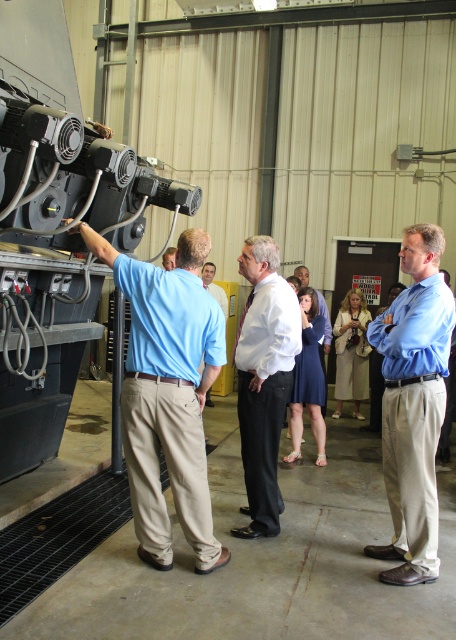
Question: Among these points, which one is nearest to the camera?

Choices:
 (A) (366, 547)
 (B) (172, 284)

Answer: (B)

Question: Which of the following is the closest to the observer?

Choices:
 (A) blue cotton shirt at left
 (B) blue shirt at center
 (C) blue dress at center

Answer: (A)

Question: Is matte blue shirt at left further to the viewer compared to blue dress at center?

Choices:
 (A) yes
 (B) no

Answer: (B)

Question: Which point is farther to the camera?

Choices:
 (A) light blue shirt at center
 (B) white dress shirt at center
 (C) blue dress at center
 (D) blue shirt at center

Answer: (D)

Question: Can you confirm if light blue shirt at center is bigger than blue dress at center?

Choices:
 (A) no
 (B) yes

Answer: (A)

Question: From the image, what is the correct spatial relationship of light blue shirt at center in relation to matte blue shirt at left?

Choices:
 (A) below
 (B) above

Answer: (A)